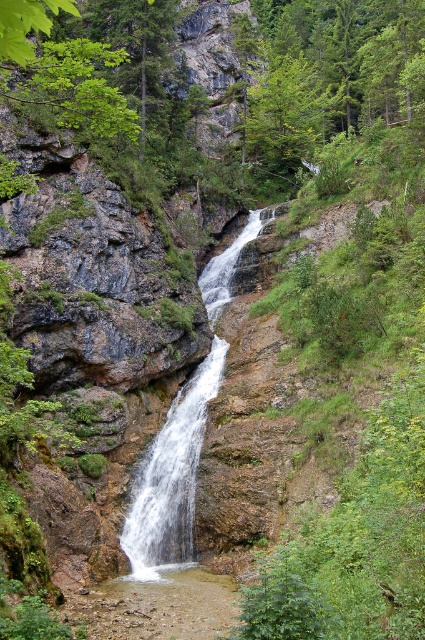
Locate an element on the screen. The height and width of the screenshot is (640, 425). white frothy water at center is located at coordinates (172, 477).

Who is more forward, (175, 458) or (186, 387)?

Point (175, 458)

Does point (234, 241) come farther from viewer compared to point (189, 410)?

Yes, it is.

Identify the location of white frothy water at center. Image resolution: width=425 pixels, height=640 pixels. (172, 477).